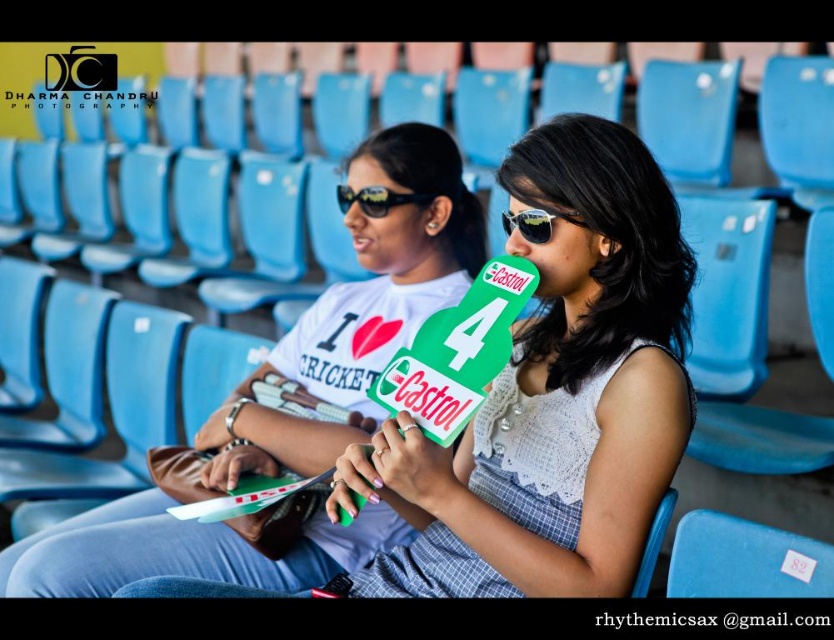
Question: Does white fabric shirt at center have a larger size compared to black reflective sunglasses at center?

Choices:
 (A) no
 (B) yes

Answer: (B)

Question: Considering the real-world distances, which object is farthest from the black reflective sunglasses at center?

Choices:
 (A) sunglasses at center
 (B) white fabric shirt at center

Answer: (A)

Question: Can you confirm if black reflective sunglasses at center is thinner than sunglasses at center?

Choices:
 (A) yes
 (B) no

Answer: (B)

Question: Estimate the real-world distances between objects in this image. Which object is closer to the sunglasses at center?

Choices:
 (A) black reflective sunglasses at center
 (B) white fabric shirt at center

Answer: (A)

Question: Which of the following is the closest to the observer?

Choices:
 (A) coord(580,227)
 (B) coord(380,243)

Answer: (A)

Question: Can you confirm if white fabric shirt at center is thinner than black reflective sunglasses at center?

Choices:
 (A) no
 (B) yes

Answer: (A)